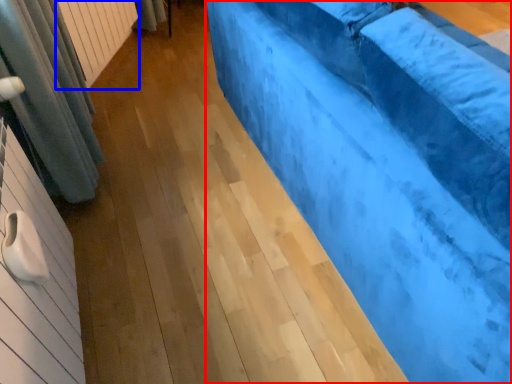
Question: Which point is further to the camera, furniture (highlighted by a red box) or radiator (highlighted by a blue box)?

Choices:
 (A) furniture
 (B) radiator

Answer: (B)